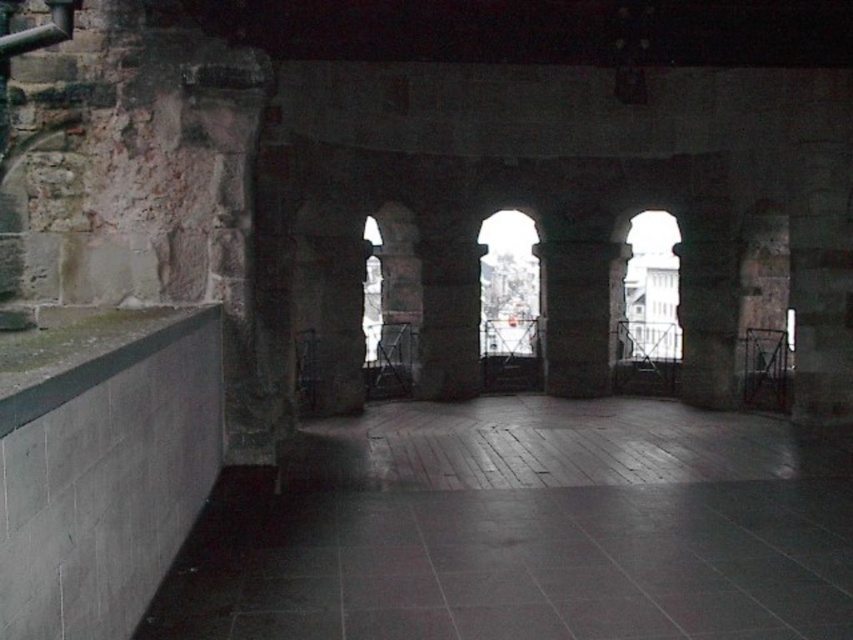
You are standing in the interior space with arches and want to reach the smooth concrete ledge at left. If your maximum reach is 8 feet, can you touch it without moving closer?

The distance between you and the smooth concrete ledge at left is 7.92 feet, which is within your 8 feet reach. Therefore, you can touch it without moving closer.

You are standing in the center of the room and want to step onto the dark gray tile floor at lower left. In which direction should you move relative to your current position?

You should move towards the lower left direction to reach the dark gray tile floor at lower left.